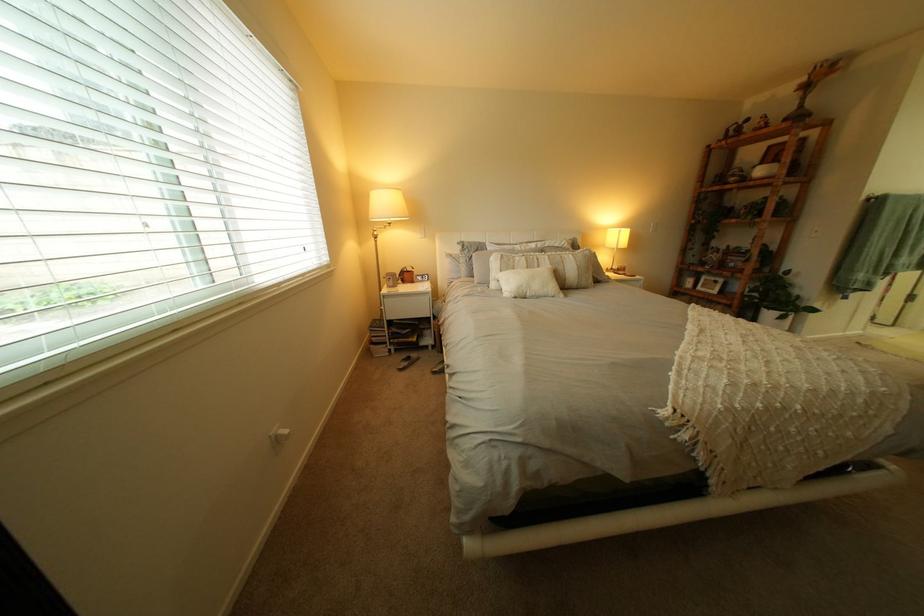
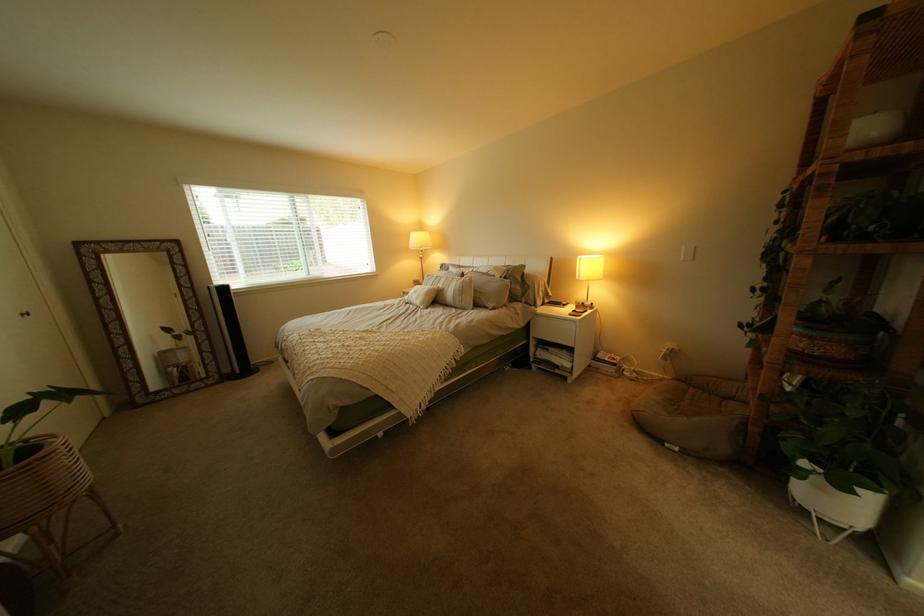
The point at (x=576, y=270) is marked in the first image. Where is the corresponding point in the second image?

(462, 290)